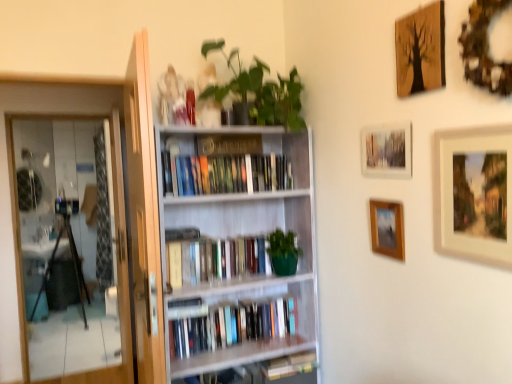
The image size is (512, 384). Find the location of `free spot above matte black paperback book at center (from a real-world perspective)`. free spot above matte black paperback book at center (from a real-world perspective) is located at coordinates (230, 136).